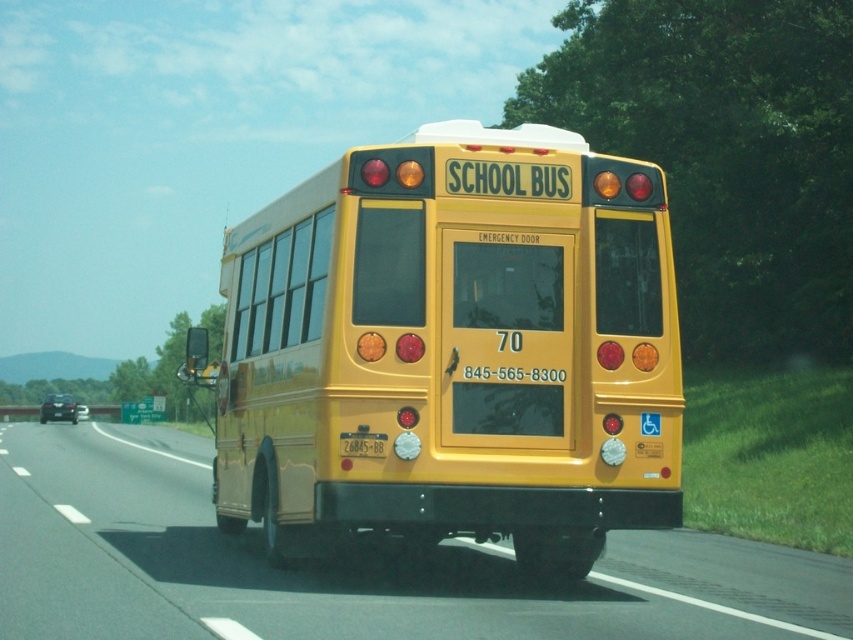
Can you confirm if yellow matte/solid school bus at center is wider than yellow matte license plate at center?

Correct, the width of yellow matte/solid school bus at center exceeds that of yellow matte license plate at center.

Can you confirm if yellow matte/solid school bus at center is positioned above yellow matte license plate at center?

Yes.

Between point (527, 150) and point (369, 444), which one is positioned behind?

Positioned behind is point (527, 150).

Identify the location of yellow matte/solid school bus at center. Image resolution: width=853 pixels, height=640 pixels. (454, 349).

Is yellow matte/solid school bus at center to the right of yellow matte school bus at center from the viewer's perspective?

Yes, yellow matte/solid school bus at center is to the right of yellow matte school bus at center.

In order to click on yellow matte/solid school bus at center in this screenshot , I will do `click(454, 349)`.

Locate an element on the screen. yellow matte/solid school bus at center is located at coordinates (454, 349).

Can you confirm if yellow matte school bus at center is smaller than yellow matte license plate at center?

Incorrect, yellow matte school bus at center is not smaller in size than yellow matte license plate at center.

Between point (445, 627) and point (379, 440), which one is positioned behind?

The point (379, 440) is more distant.

Locate an element on the screen. yellow matte school bus at center is located at coordinates (345, 566).